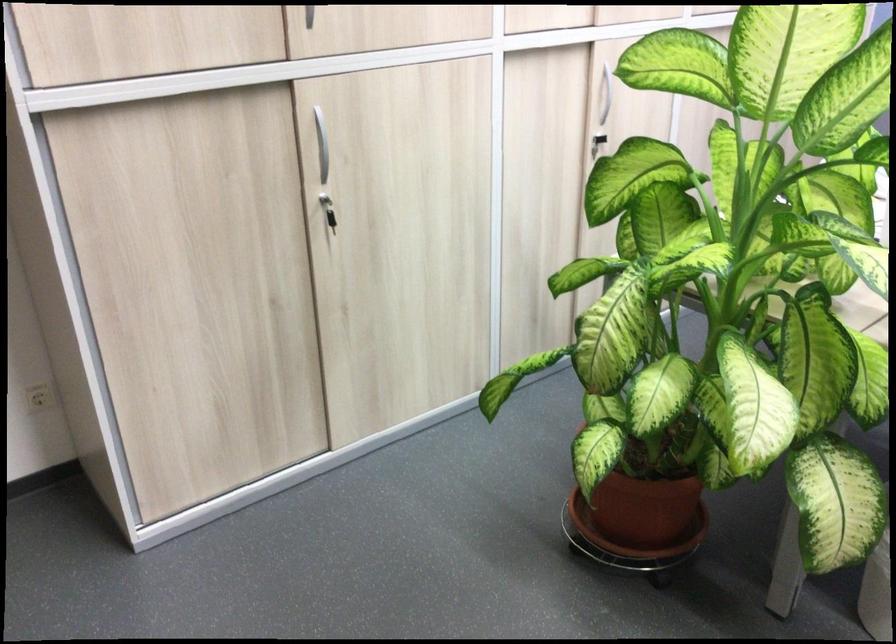
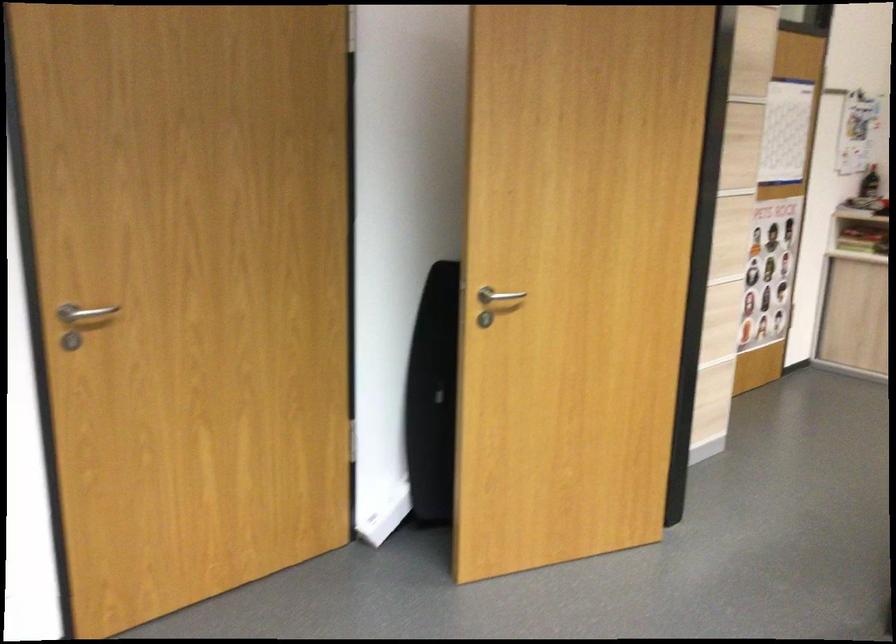
Question: The camera is either moving clockwise (left) or counter-clockwise (right) around the object. The first image is from the beginning of the video and the second image is from the end. Is the camera moving left or right when shooting the video?

Choices:
 (A) Left
 (B) Right

Answer: (B)